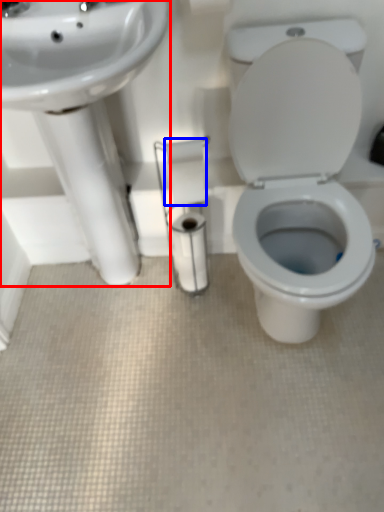
Question: Which object appears closest to the camera in this image, sink (highlighted by a red box) or toilet paper (highlighted by a blue box)?

Choices:
 (A) sink
 (B) toilet paper

Answer: (A)